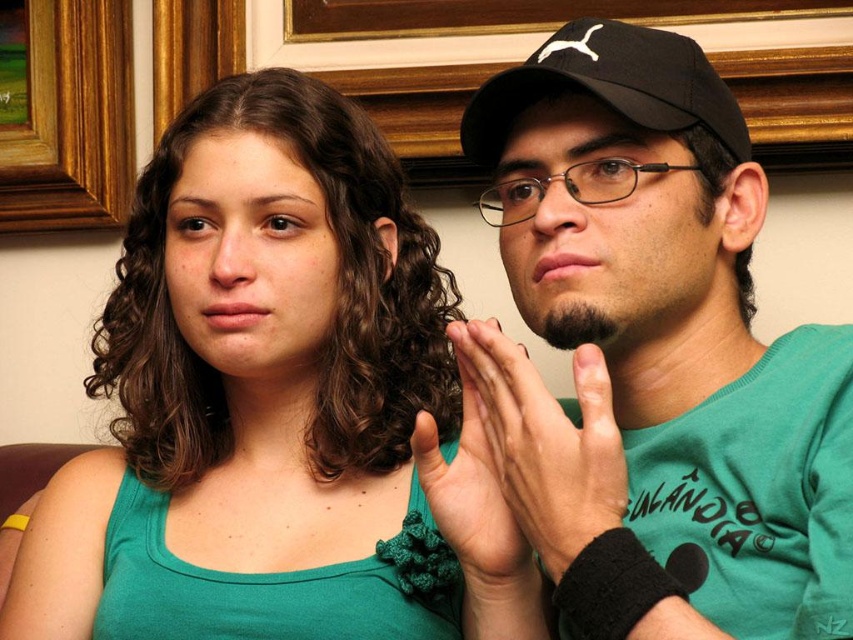
You are a photographer adjusting your camera settings. You notice the green fabric tank top at center and the brown wooden picture frame at upper left in your viewfinder. Which object is closer to the left edge of the frame?

The brown wooden picture frame at upper left is closer to the left edge of the frame because the green fabric tank top at center is positioned on its right side.

You are designing a display case for a hat collection. The case has two compartments. The first compartment can only fit items smaller than 20 cm in diameter. The second compartment can accommodate items up to 25 cm in diameter. You have two hats to place in the case. One is the black matte cap at upper center and the other is the black fabric baseball cap at upper center. Based on the description, which hat should go in each compartment?

The black matte cap at upper center is bigger than the black fabric baseball cap at upper center. Therefore, the black matte cap at upper center should go in the second compartment which can hold up to 25 cm, and the black fabric baseball cap at upper center should be placed in the first compartment designed for items smaller than 20 cm.